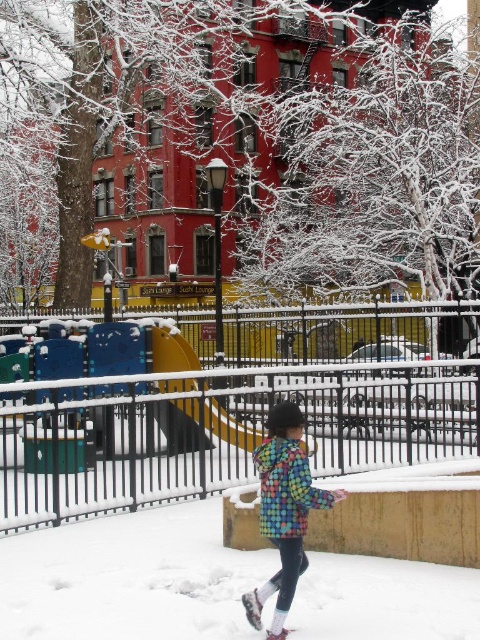
Consider the image. Does metallic black fence at center come in front of multicolored quilted jacket at center?

That is False.

Can you confirm if metallic black fence at center is positioned above multicolored quilted jacket at center?

Correct, metallic black fence at center is located above multicolored quilted jacket at center.

What are the coordinates of `metallic black fence at center` in the screenshot? It's located at (237, 410).

I want to click on metallic black fence at center, so click(x=237, y=410).

Who is more distant from viewer, (304, 452) or (196, 420)?

The point (196, 420) is more distant.

Which is behind, point (253, 621) or point (193, 378)?

The point (193, 378) is behind.

Find the location of a particular element. This screenshot has width=480, height=640. multicolored quilted jacket at center is located at coordinates (284, 509).

Does metallic black fence at center appear under yellow plastic slide at center?

No.

I want to click on metallic black fence at center, so click(x=237, y=410).

Locate an element on the screen. metallic black fence at center is located at coordinates (237, 410).